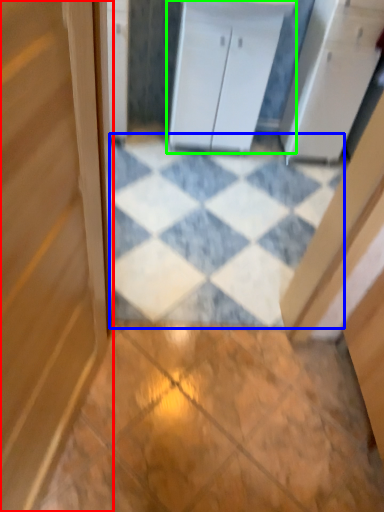
Question: Based on their relative distances, which object is nearer to door (highlighted by a red box)? Choose from tile (highlighted by a blue box) and cabinetry (highlighted by a green box).

Choices:
 (A) tile
 (B) cabinetry

Answer: (A)